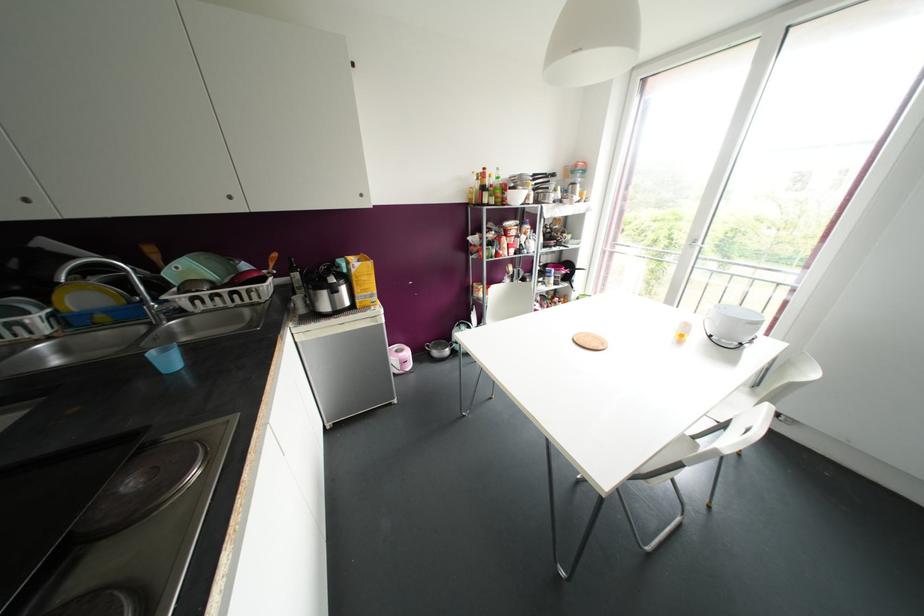
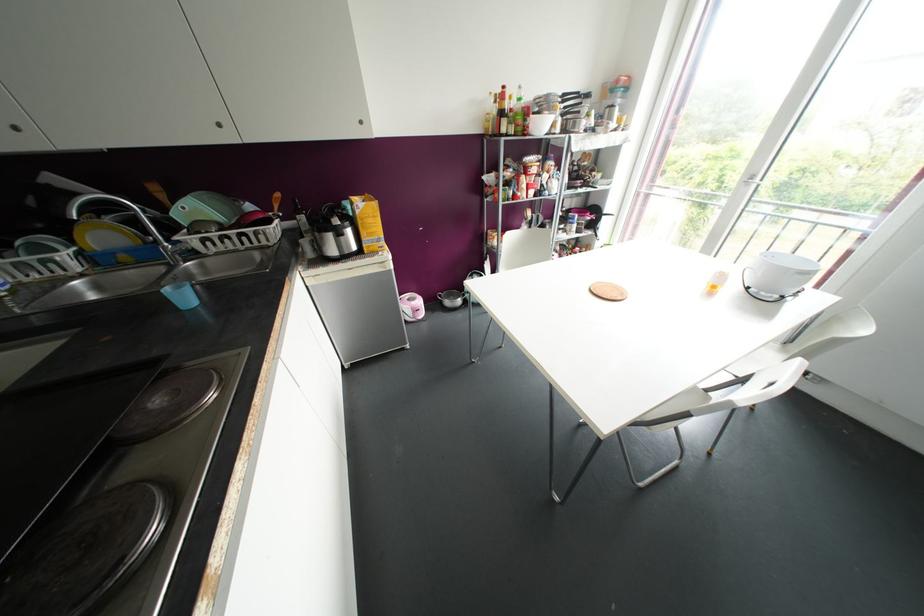
In the second image, find the point that corresponds to the point at 400,354 in the first image.

(412, 302)